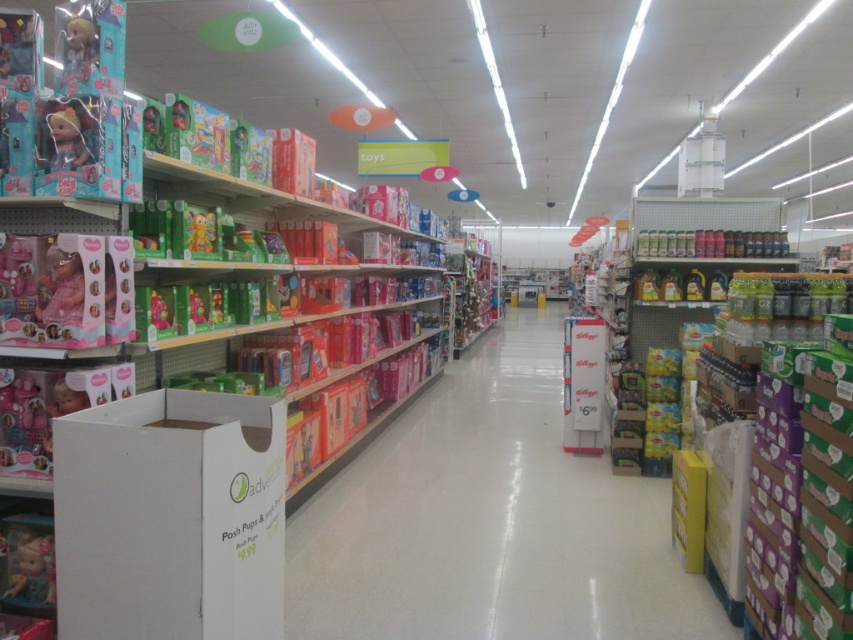
You are a customer in the toy store and want to find the matte pink doll at left. According to the store layout, where should you look in the aisle?

The matte pink doll at left is located at the 2D coordinates point (67, 291) in the aisle.

You are a customer in the toy store and see the matte pink doll at lower left and the shiny green plastic toy at left. Which toy is positioned closer to the left side of the aisle?

The matte pink doll at lower left is positioned closer to the left side of the aisle because it is to the left of the shiny green plastic toy at left.

You are a store employee who needs to place a new sign at coordinate point 0.1, 0.1. Will the matte pink doll at upper left interfere with the placement of the sign at that location?

The matte pink doll at upper left is located at point (x=80, y=45), which is very close to the desired coordinate of (x=84, y=64). Depending on the size of the sign and the doll, there might be a slight interference. However, since the coordinates are not exactly the same, it might still be possible to place the sign there with careful positioning.